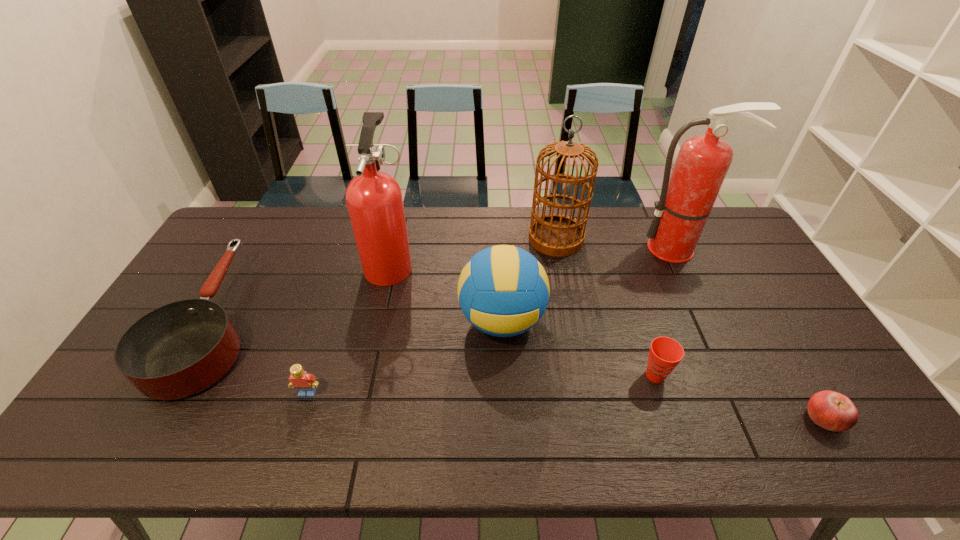
This screenshot has width=960, height=540. Find the location of `vacant space located on the right of the birdcage`. vacant space located on the right of the birdcage is located at coordinates (680, 239).

I want to click on free space located on the left of the volleyball, so click(442, 321).

This screenshot has height=540, width=960. In order to click on vacant space positioned on the front-facing side of the second object from left to right in this screenshot , I will do `click(300, 421)`.

At what (x,y) coordinates should I click in order to perform the action: click on vacant region located on the right of the cup. Please return your answer as a coordinate pair (x, y). Looking at the image, I should click on tap(757, 375).

The image size is (960, 540). Find the location of `free space located 0.270m on the handle side of the leftmost object`. free space located 0.270m on the handle side of the leftmost object is located at coordinates (275, 213).

Locate an element on the screen. The width and height of the screenshot is (960, 540). vacant area situated 0.140m on the handle side of the leftmost object is located at coordinates (263, 235).

Where is `vacant space positioned 0.160m on the handle side of the leftmost object`? The height and width of the screenshot is (540, 960). vacant space positioned 0.160m on the handle side of the leftmost object is located at coordinates (265, 231).

Identify the location of blank area located 0.140m on the left of the shortest object. This screenshot has height=540, width=960. tap(747, 418).

The height and width of the screenshot is (540, 960). I want to click on birdcage present at the far edge, so click(x=558, y=235).

At what (x,y) coordinates should I click in order to perform the action: click on object at the near edge. Please return your answer as a coordinate pair (x, y). The width and height of the screenshot is (960, 540). Looking at the image, I should click on (833, 411).